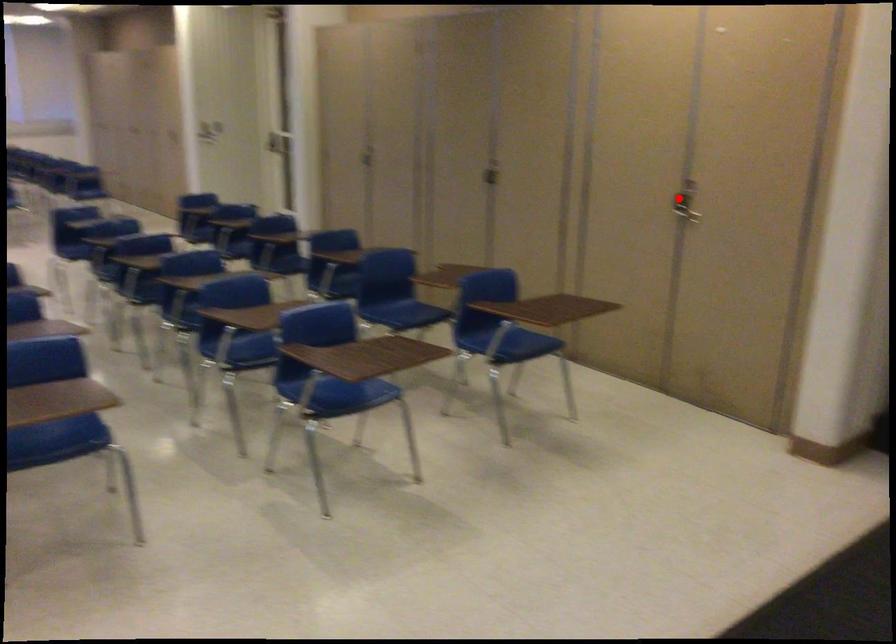
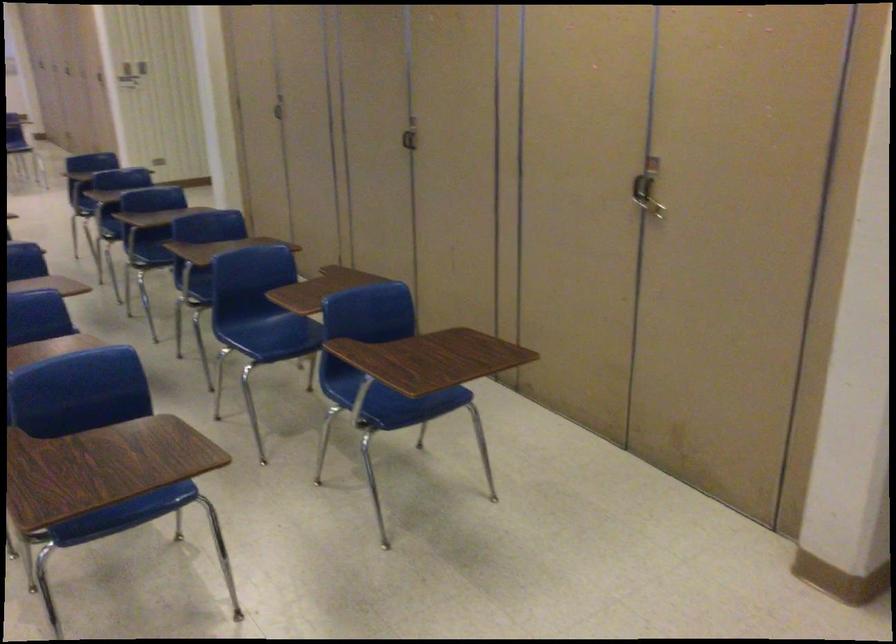
The point at the highlighted location is marked in the first image. Where is the corresponding point in the second image?

(647, 187)